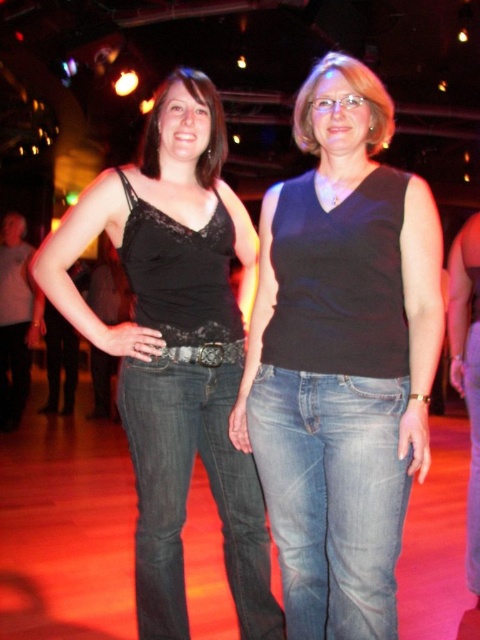
Who is positioned more to the right, black matte tank top at center or matte black tank top at left?

From the viewer's perspective, black matte tank top at center appears more on the right side.

Can you confirm if black matte tank top at center is wider than matte black tank top at left?

Incorrect, black matte tank top at center's width does not surpass matte black tank top at left's.

This screenshot has height=640, width=480. Describe the element at coordinates (342, 358) in the screenshot. I see `black matte tank top at center` at that location.

Identify the location of black matte tank top at center. The height and width of the screenshot is (640, 480). (342, 358).